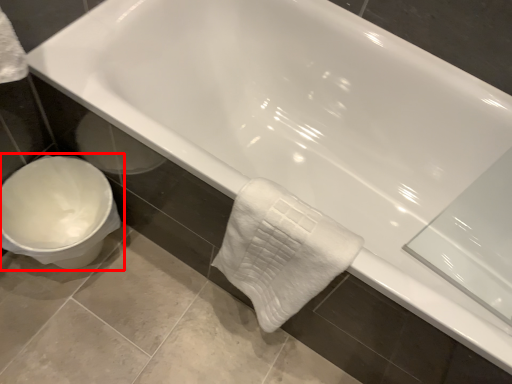
Question: Observing the image, what is the correct spatial positioning of toilet (annotated by the red box) in reference to bath towel?

Choices:
 (A) left
 (B) right

Answer: (A)